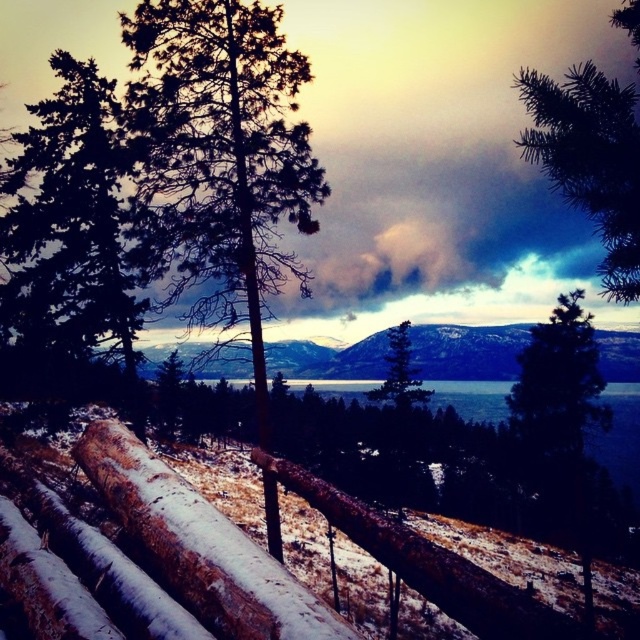
You are standing in the middle of the landscape scene. There are two points marked in the image, point A at coordinates point A is point (628, 209) and point B at coordinates point B is point (397, 403). Which point is closer to you?

Point A at coordinates point (628, 209) is closer to you than point B at coordinates point (397, 403).